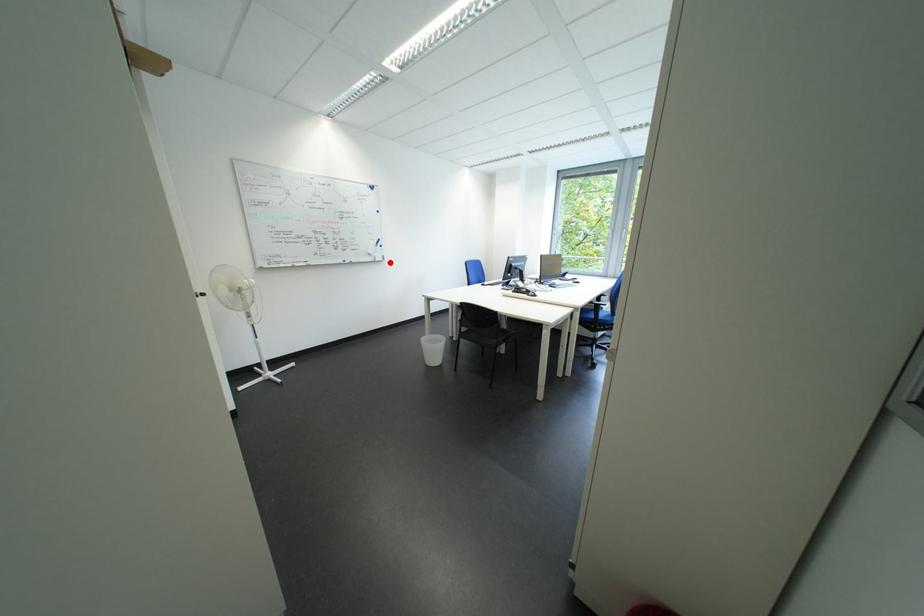
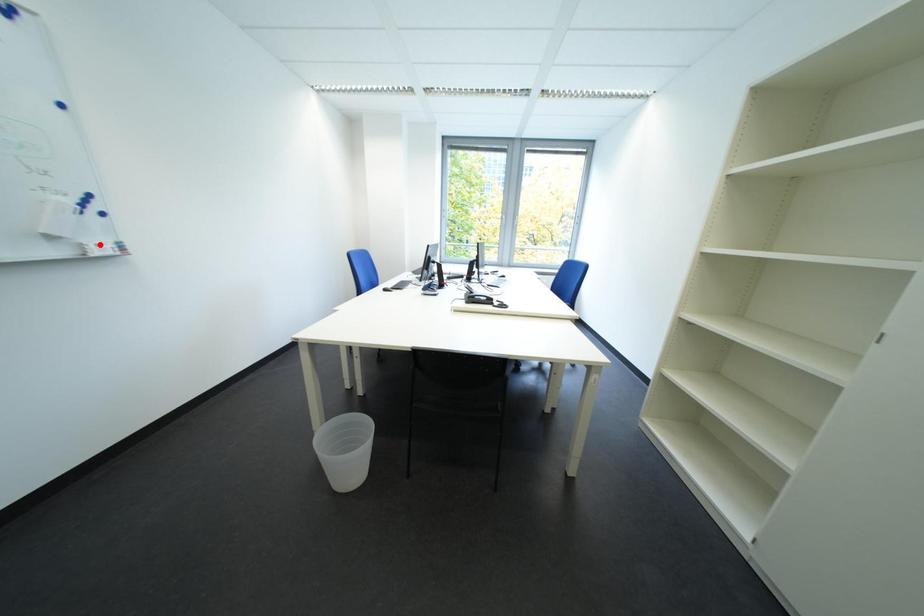
I am providing you with two images of the same scene from different viewpoints. A red point is marked on the first image and another point is marked on the second image. Are the points marked in image1 and image2 representing the same 3D position?

No